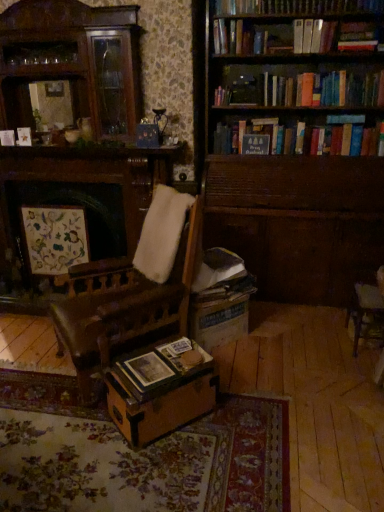
Question: Is hardcover book at upper right, the third book positioned from the left, taller than wooden bookshelf at upper right?

Choices:
 (A) yes
 (B) no

Answer: (B)

Question: Is hardcover book at upper right, the third book positioned from the left, thinner than wooden bookshelf at upper right?

Choices:
 (A) no
 (B) yes

Answer: (B)

Question: Can you confirm if hardcover book at upper right, which is counted as the second book, starting from the front, is bigger than wooden bookshelf at upper right?

Choices:
 (A) no
 (B) yes

Answer: (A)

Question: Would you say hardcover book at upper right, the third book when ordered from bottom to top, is outside wooden bookshelf at upper right?

Choices:
 (A) no
 (B) yes

Answer: (A)

Question: Is hardcover book at upper right, which appears as the second book when viewed from the back, smaller than wooden bookshelf at upper right?

Choices:
 (A) no
 (B) yes

Answer: (B)

Question: Based on their sizes in the image, would you say matte paper at center is bigger or smaller than hardcover book at upper center, marked as the second book in a top-to-bottom arrangement?

Choices:
 (A) small
 (B) big

Answer: (A)

Question: Considering the positions of matte paper at center and hardcover book at upper center, which is the 1th book in back-to-front order, in the image, is matte paper at center taller or shorter than hardcover book at upper center, which is the 1th book in back-to-front order,?

Choices:
 (A) tall
 (B) short

Answer: (B)

Question: Which is correct: matte paper at center is inside hardcover book at upper center, marked as the second book in a top-to-bottom arrangement, or outside of it?

Choices:
 (A) outside
 (B) inside

Answer: (A)

Question: Relative to hardcover book at upper center, marked as the second book in a top-to-bottom arrangement, is matte paper at center in front or behind?

Choices:
 (A) behind
 (B) front

Answer: (B)

Question: Is wooden chair at right inside the boundaries of wooden photo album at center, marked as the 3th book in a back-to-front arrangement, or outside?

Choices:
 (A) outside
 (B) inside

Answer: (A)

Question: In the image, is wooden chair at right positioned in front of or behind wooden photo album at center, the third book from the right?

Choices:
 (A) front
 (B) behind

Answer: (B)

Question: From a real-world perspective, is wooden chair at right physically located above or below wooden photo album at center, which ranks as the first book in front-to-back order?

Choices:
 (A) below
 (B) above

Answer: (B)

Question: Considering the positions of wooden chair at right and wooden photo album at center, marked as the 3th book in a back-to-front arrangement, in the image, is wooden chair at right wider or thinner than wooden photo album at center, marked as the 3th book in a back-to-front arrangement,?

Choices:
 (A) wide
 (B) thin

Answer: (A)

Question: From their relative heights in the image, would you say hardcover book at upper right, the first book viewed from the right, is taller or shorter than hardcover book at upper center, which is the 1th book in back-to-front order?

Choices:
 (A) tall
 (B) short

Answer: (A)

Question: Is hardcover book at upper right, the third book positioned from the left, to the left or to the right of hardcover book at upper center, which is the 1th book in back-to-front order, in the image?

Choices:
 (A) left
 (B) right

Answer: (B)